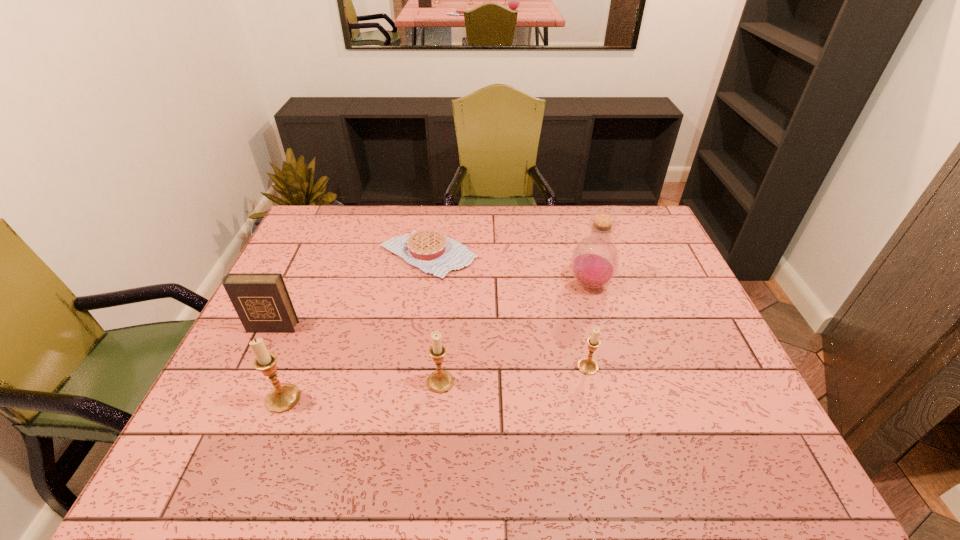
The height and width of the screenshot is (540, 960). Identify the location of free space between the shortest object and the second candle holder from right to left. (434, 319).

This screenshot has height=540, width=960. What are the coordinates of `free area in between the diary and the pie` in the screenshot? It's located at (350, 291).

Locate which object ranks fourth in proximity to the second shortest candle holder. Please provide its 2D coordinates. Your answer should be formatted as a tuple, i.e. [(x, y)], where the tuple contains the x and y coordinates of a point satisfying the conditions above.

[(261, 300)]

Locate an element on the screen. The height and width of the screenshot is (540, 960). the second closest object to the leftmost candle holder is located at coordinates (440, 381).

Locate an element on the screen. This screenshot has width=960, height=540. candle holder object that ranks as the second closest to the second shortest object is located at coordinates (283, 397).

Where is `candle holder object that ranks as the second closest to the second candle holder from right to left`? This screenshot has width=960, height=540. candle holder object that ranks as the second closest to the second candle holder from right to left is located at coordinates (588, 366).

This screenshot has width=960, height=540. In order to click on free location that satisfies the following two spatial constraints: 1. on the front cover of the fourth nearest object; 2. on the right side of the second candle holder from right to left in this screenshot , I will do `click(246, 382)`.

The image size is (960, 540). What are the coordinates of `free space that satisfies the following two spatial constraints: 1. on the front cover of the fourth nearest object; 2. on the left side of the second candle holder from left to right` in the screenshot? It's located at (246, 382).

Locate an element on the screen. This screenshot has height=540, width=960. vacant position in the image that satisfies the following two spatial constraints: 1. on the front cover of the diary; 2. on the right side of the leftmost candle holder is located at coordinates (238, 399).

Find the location of a particular element. vacant position in the image that satisfies the following two spatial constraints: 1. on the front cover of the diary; 2. on the left side of the second candle holder from right to left is located at coordinates (246, 382).